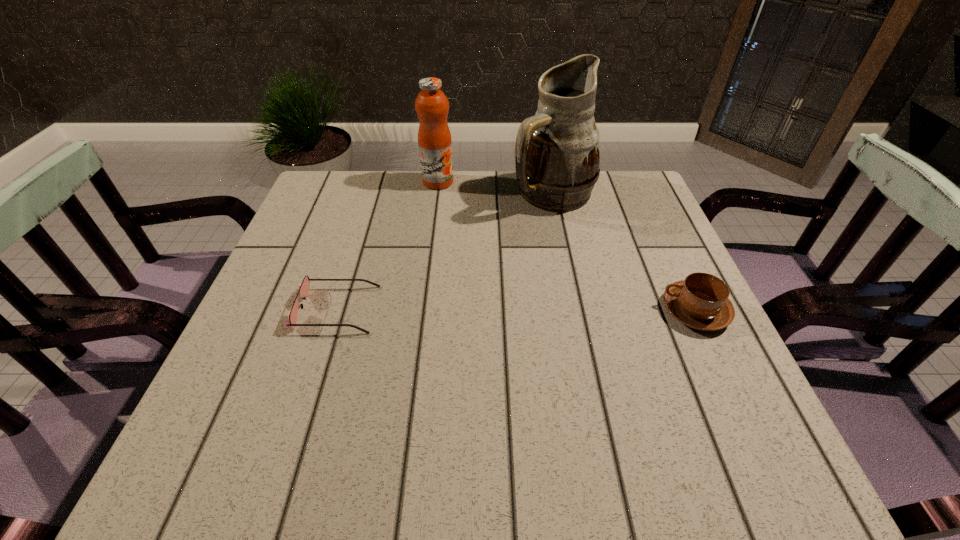
Find the location of a particular element. Image resolution: width=960 pixels, height=540 pixels. vacant position located on the side of the rightmost object with the handle is located at coordinates (501, 310).

Identify the location of free location located 0.290m on the side of the rightmost object with the handle. (520, 310).

Image resolution: width=960 pixels, height=540 pixels. What are the coordinates of `vacant space located on the front label of the fruit juice` in the screenshot? It's located at (475, 255).

The height and width of the screenshot is (540, 960). I want to click on vacant area located 0.240m on the front label of the fruit juice, so click(468, 242).

Identify the location of free point located on the front label of the fruit juice. (449, 204).

The image size is (960, 540). Find the location of `free space located from the spout of the tallest object`. free space located from the spout of the tallest object is located at coordinates (551, 296).

Where is `free space located 0.160m from the spout of the tallest object`? free space located 0.160m from the spout of the tallest object is located at coordinates (552, 261).

Find the location of a particular element. vacant region located 0.220m from the spout of the tallest object is located at coordinates (551, 280).

Identify the location of fruit juice situated at the far edge. The height and width of the screenshot is (540, 960). (434, 137).

The image size is (960, 540). I want to click on pitcher situated at the far edge, so click(x=557, y=156).